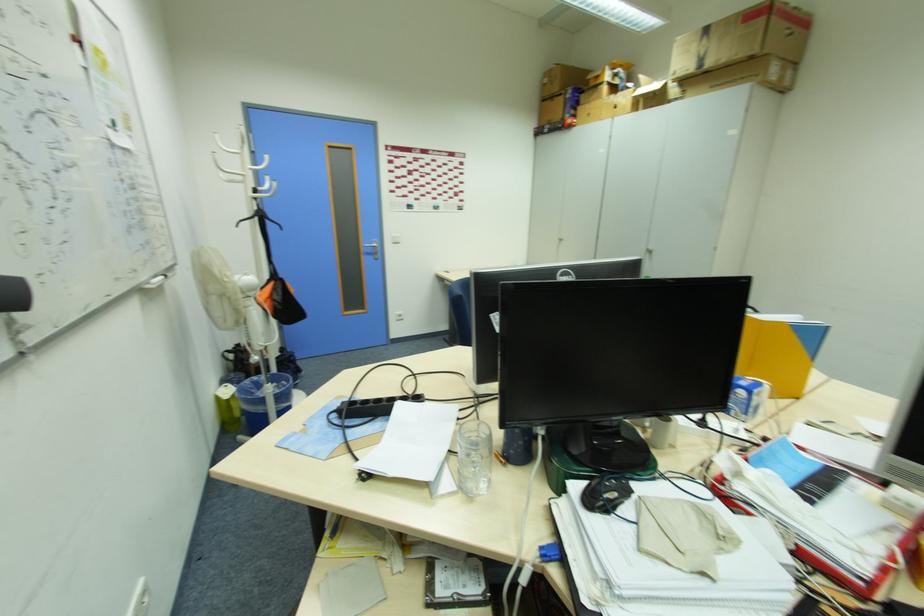
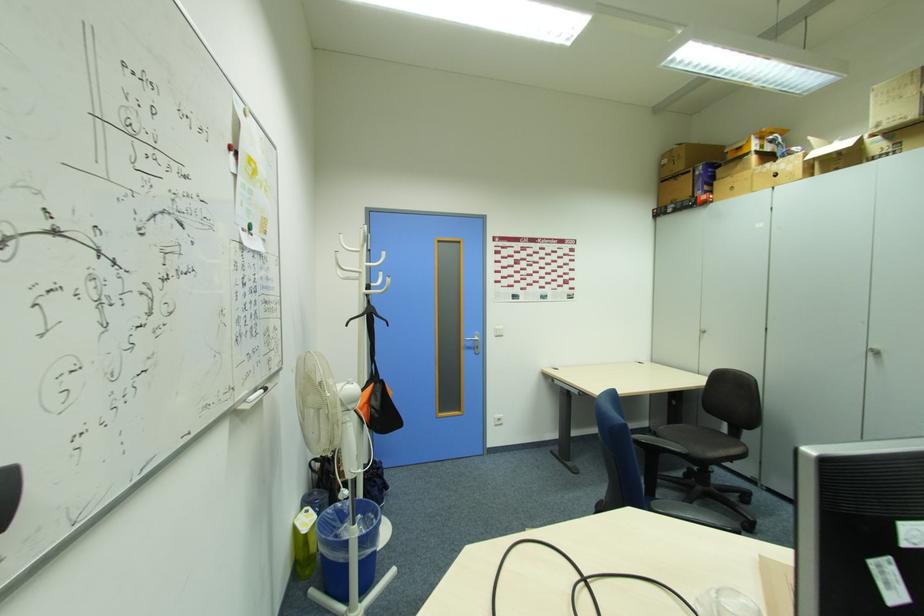
Question: The first image is from the beginning of the video and the second image is from the end. How did the camera likely rotate when shooting the video?

Choices:
 (A) Left
 (B) Right
 (C) Up
 (D) Down

Answer: (C)